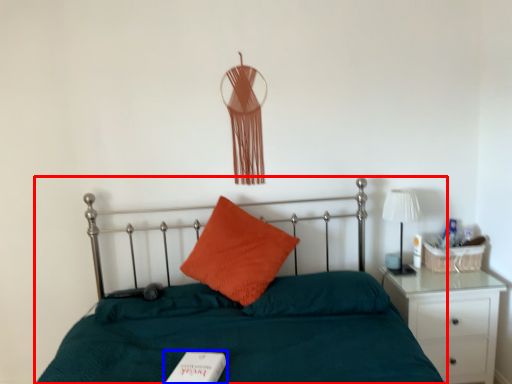
Question: Which object is closer to the camera taking this photo, bed (highlighted by a red box) or book (highlighted by a blue box)?

Choices:
 (A) bed
 (B) book

Answer: (A)